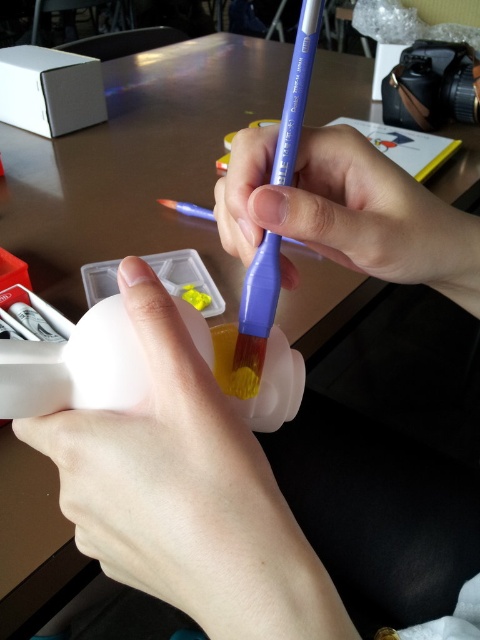
Is white matte paintbrush at center smaller than purple plastic paint brush at center?

Incorrect, white matte paintbrush at center is not smaller in size than purple plastic paint brush at center.

Between white matte paintbrush at center and purple plastic paint brush at center, which one appears on the right side from the viewer's perspective?

purple plastic paint brush at center is more to the right.

Describe the element at coordinates (140, 500) in the screenshot. I see `white matte paintbrush at center` at that location.

Locate an element on the screen. The width and height of the screenshot is (480, 640). white matte paintbrush at center is located at coordinates (140, 500).

Who is more forward, (231, 156) or (310, 16)?

Point (310, 16) is more forward.

Between point (414, 276) and point (289, 147), which one is positioned behind?

The point (414, 276) is behind.

Where is `purple plastic toothbrush at upper center`? The width and height of the screenshot is (480, 640). purple plastic toothbrush at upper center is located at coordinates (347, 211).

Can you confirm if purple plastic toothbrush at upper center is positioned below white matte paintbrush at center?

No.

Between purple plastic toothbrush at upper center and white matte paintbrush at center, which one is positioned higher?

purple plastic toothbrush at upper center

This screenshot has width=480, height=640. Identify the location of purple plastic toothbrush at upper center. (347, 211).